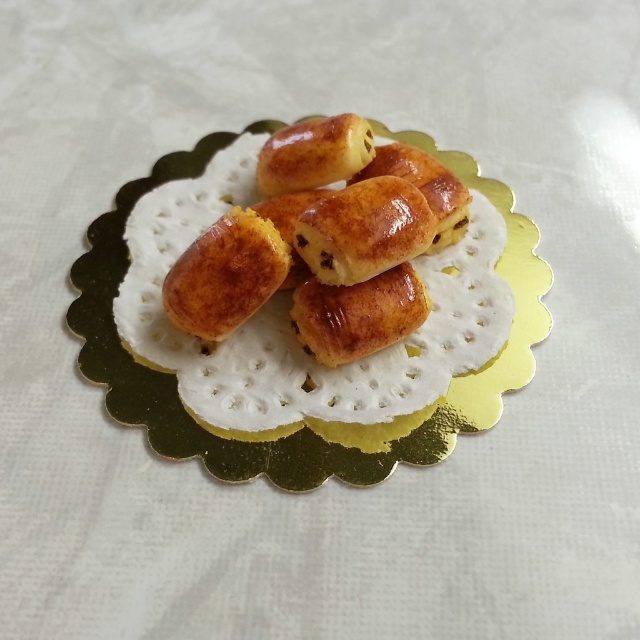
You are a chef standing at a distance of 4 feet from the golden glazed pastry at center. You want to grab it without moving your feet. Can you reach it?

The golden glazed pastry at center and camera are 4.29 feet apart. Since you are standing 4 feet away, you can reach it because you are closer than the distance between the pastry and the camera.

You are arranging a dessert display and need to place a new dessert between the golden glazed pastry at center and the golden paper doily at center. Based on their current positions, where should you place the new dessert to ensure it is between them?

The golden glazed pastry at center is positioned on the left side of the golden paper doily at center, so you should place the new dessert between them to the right of the pastry and to the left of the doily.